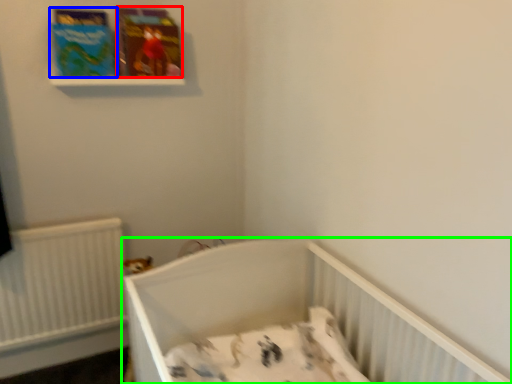
Question: Which is nearer to the paperback book (highlighted by a red box)? paperback book (highlighted by a blue box) or infant bed (highlighted by a green box).

Choices:
 (A) paperback book
 (B) infant bed

Answer: (A)